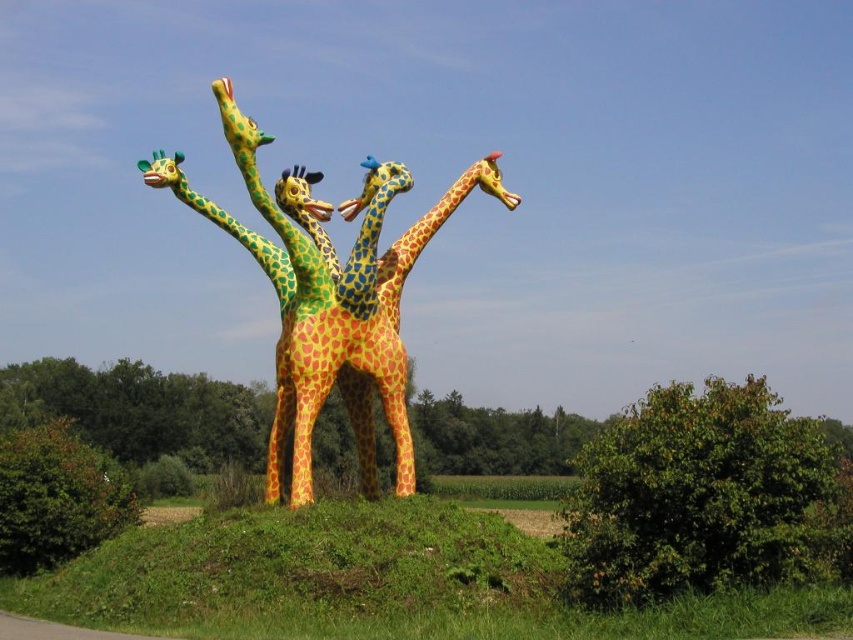
Does glossy painted giraffes at center have a lesser width compared to green matte bush at lower left?

Indeed, glossy painted giraffes at center has a lesser width compared to green matte bush at lower left.

Is glossy painted giraffes at center above green matte bush at lower left?

Yes.

Which is in front, point (360, 454) or point (3, 564)?

Point (3, 564)

Locate an element on the screen. This screenshot has width=853, height=640. glossy painted giraffes at center is located at coordinates (329, 294).

Based on the photo, does green leafy bush at center appear on the right side of green matte bush at lower left?

Yes, green leafy bush at center is to the right of green matte bush at lower left.

Which is more to the left, green leafy bush at center or green matte bush at lower left?

green matte bush at lower left is more to the left.

The image size is (853, 640). In order to click on green leafy bush at center in this screenshot , I will do `click(695, 496)`.

Locate an element on the screen. This screenshot has height=640, width=853. green leafy bush at center is located at coordinates (695, 496).

Between point (775, 417) and point (343, 301), which one is positioned behind?

The point (343, 301) is behind.

Does point (834, 492) come behind point (222, 227)?

That is False.

Is point (822, 451) more distant than point (384, 212)?

No, it is not.

At what (x,y) coordinates should I click in order to perform the action: click on green leafy bush at center. Please return your answer as a coordinate pair (x, y). Looking at the image, I should click on (695, 496).